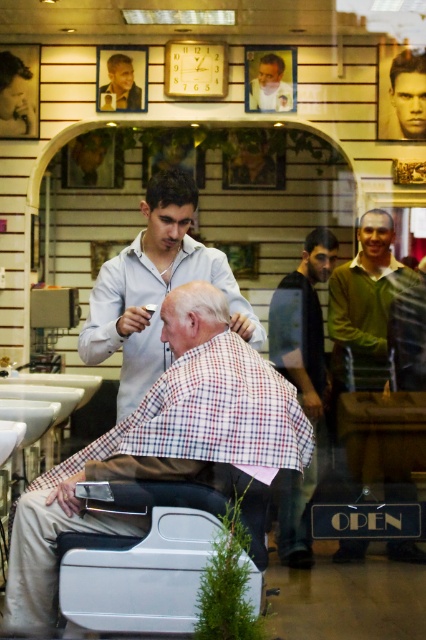
You are a customer entering the barbershop and see two men with haircuts displayed on the wall. The dark brown hair at upper right and the smooth brown hair at upper left. Which one has a bigger hair style?

The dark brown hair at upper right has a bigger hairstyle than the smooth brown hair at upper left.

Based on the scene described, which hair has a larger size between the dark brown hair at upper left and the smooth brown hair at upper center?

The dark brown hair at upper left has a larger size compared to the smooth brown hair at upper center.